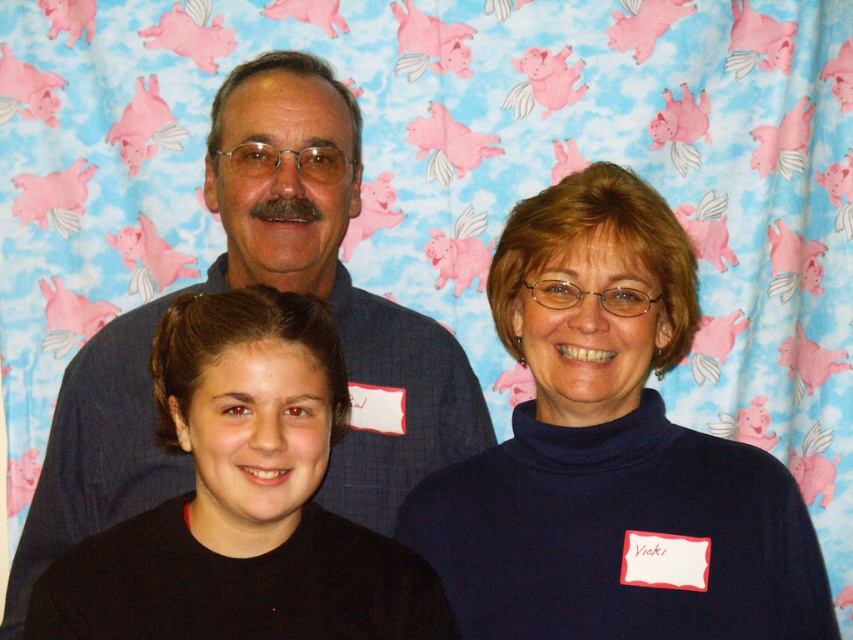
Which of these two, dark blue turtleneck sweater at center or blue denim shirt at upper center, stands shorter?

dark blue turtleneck sweater at center

Which is above, dark blue turtleneck sweater at center or blue denim shirt at upper center?

blue denim shirt at upper center

Does point (780, 528) lie in front of point (177, 486)?

Yes, it is in front of point (177, 486).

Where is `dark blue turtleneck sweater at center`? dark blue turtleneck sweater at center is located at coordinates (611, 452).